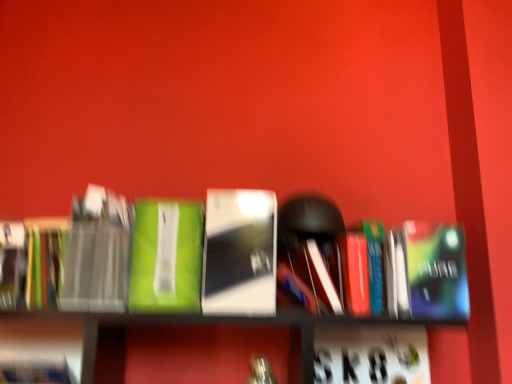
Question: Based on their positions, is matte black book at left, which ranks as the 3th paperback book in left-to-right order, located to the left or right of metallic silver book at center, placed as the 1th book when sorted from right to left?

Choices:
 (A) left
 (B) right

Answer: (A)

Question: From the image's perspective, is matte black book at left, the second paperback book positioned from the right, located above or below metallic silver book at center, the second book from the left?

Choices:
 (A) above
 (B) below

Answer: (A)

Question: Considering the real-world distances, which object is farthest from the green matte book at center, the second book positioned from the right?

Choices:
 (A) hardcover book at left, the 1th paperback book viewed from the left
 (B) matte black book at left, the second paperback book positioned from the right
 (C) metallic silver book at center, placed as the 1th book when sorted from right to left
 (D) metallic blue paperback book at center right, which is counted as the 4th paperback book, starting from the left
 (E) multicolored paper at left, the 2th paperback book in the left-to-right sequence

Answer: (D)

Question: Based on their relative distances, which object is farther from the green matte book at center, the first book viewed from the left?

Choices:
 (A) hardcover book at left, the 4th paperback book from the right
 (B) multicolored paper at left, the 2th paperback book in the left-to-right sequence
 (C) matte black book at left, which ranks as the 3th paperback book in left-to-right order
 (D) metallic blue paperback book at center right, which is counted as the 4th paperback book, starting from the left
 (E) metallic silver book at center, the second book from the left

Answer: (D)